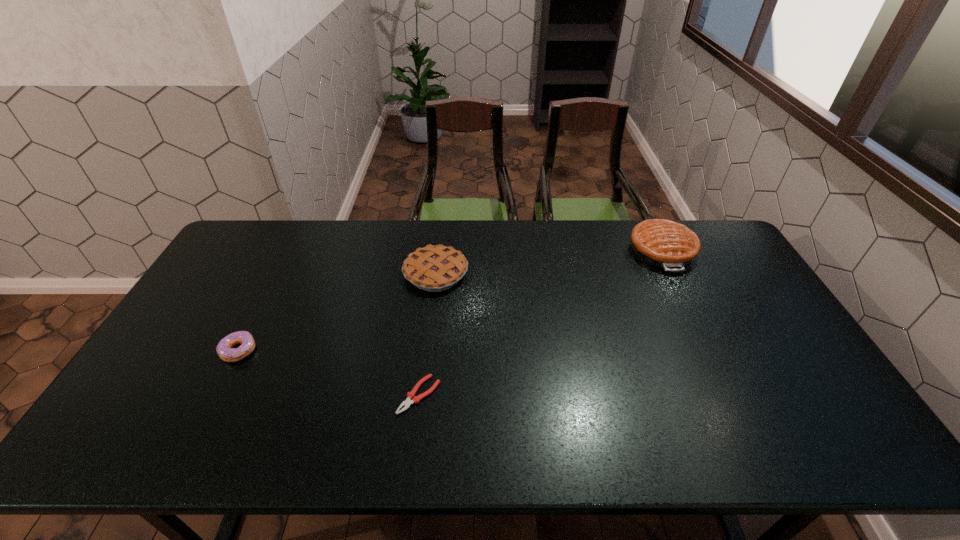
Image resolution: width=960 pixels, height=540 pixels. What are the coordinates of `the rightmost object` in the screenshot? It's located at (662, 243).

You are a GUI agent. You are given a task and a screenshot of the screen. Output one action in this format:
    pyautogui.click(x=<x>, y=<y>)
    Task: Click on the right pie
    
    Given the screenshot: What is the action you would take?
    pyautogui.click(x=662, y=243)

Locate an element on the screen. The height and width of the screenshot is (540, 960). the left pie is located at coordinates (436, 268).

Identify the location of the shorter pie. This screenshot has height=540, width=960. (436, 268).

Identify the location of the third farthest object. This screenshot has height=540, width=960. (224, 349).

Locate an element on the screen. doughnut is located at coordinates (224, 349).

At what (x,y) coordinates should I click in order to perform the action: click on the shortest object. Please return your answer as a coordinate pair (x, y). This screenshot has height=540, width=960. Looking at the image, I should click on (411, 398).

The image size is (960, 540). Find the location of `the nearest object`. the nearest object is located at coordinates (411, 398).

At what (x,y) coordinates should I click in order to perform the action: click on free space located on the front of the tallest object. Please return your answer as a coordinate pair (x, y). The height and width of the screenshot is (540, 960). Looking at the image, I should click on (695, 318).

I want to click on vacant space located on the front of the third shortest object, so click(x=426, y=360).